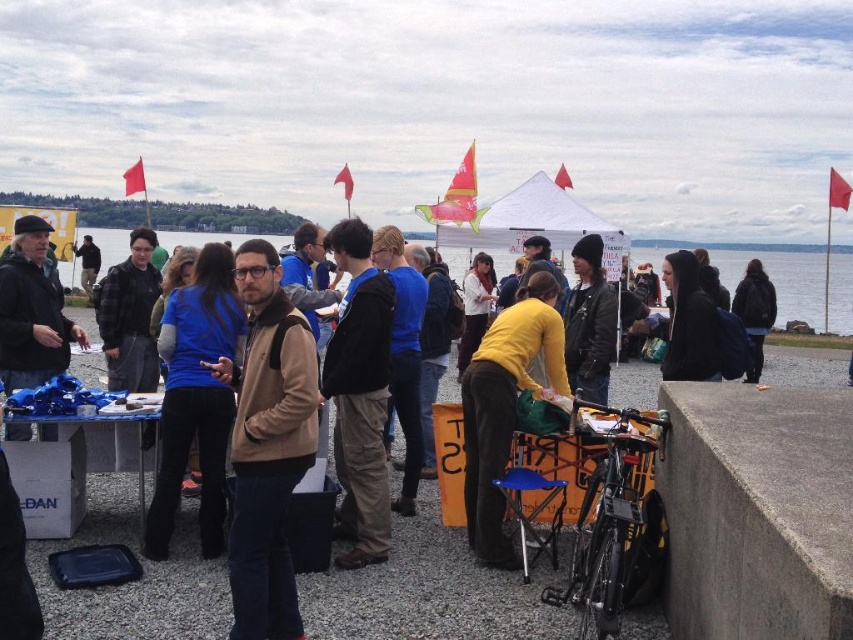
Is point (256, 320) positioned in front of point (527, 348)?

Yes, it is in front of point (527, 348).

Which of these two, brown suede jacket at center or yellow matte shirt at center, stands shorter?

yellow matte shirt at center is shorter.

Does point (281, 305) lie in front of point (544, 316)?

Yes, it is.

What are the coordinates of `brown suede jacket at center` in the screenshot? It's located at (267, 445).

Can you confirm if concrete ledge at lower right is wider than brown suede jacket at center?

Correct, the width of concrete ledge at lower right exceeds that of brown suede jacket at center.

This screenshot has width=853, height=640. In order to click on concrete ledge at lower right in this screenshot , I will do `click(757, 512)`.

Find the location of a particular element. The width and height of the screenshot is (853, 640). concrete ledge at lower right is located at coordinates click(x=757, y=512).

Based on the photo, does concrete ledge at lower right appear over yellow matte shirt at center?

No, concrete ledge at lower right is not above yellow matte shirt at center.

Which is behind, point (834, 612) or point (509, 392)?

The point (509, 392) is behind.

Identify the location of concrete ledge at lower right. (757, 512).